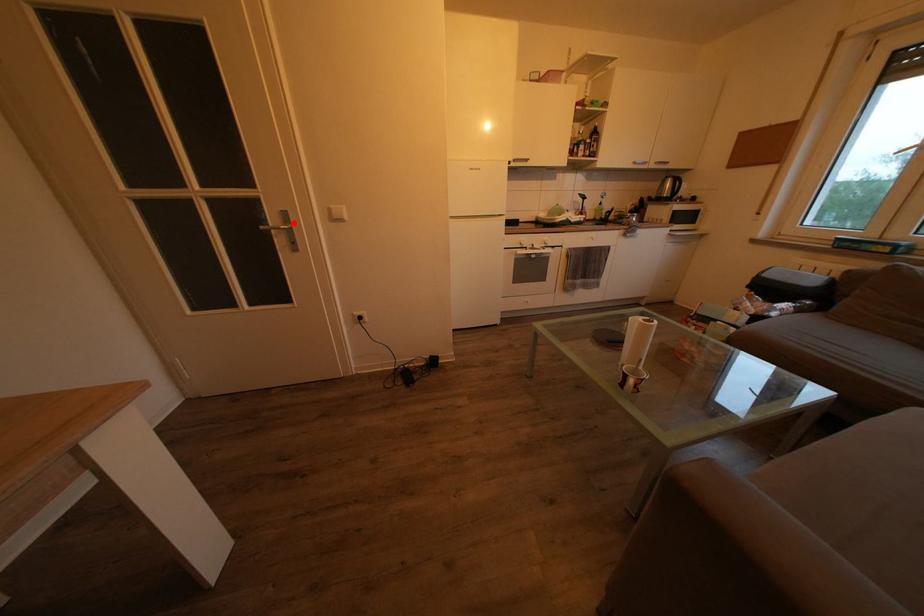
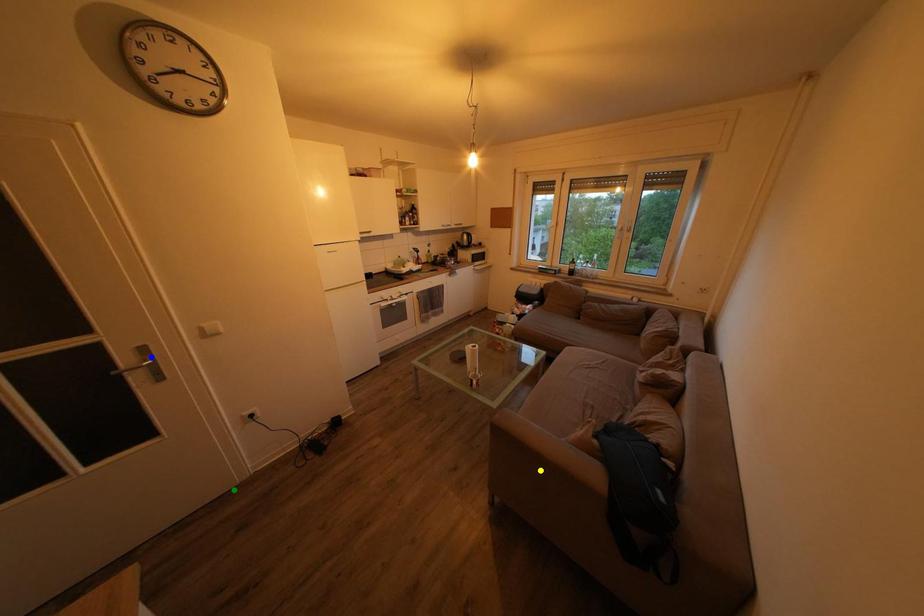
Question: I am providing you with two images of the same scene from different viewpoints. A red point is marked on the first image. You are given multiple points on the second image. Which mark in image 2 goes with the point in image 1?

Choices:
 (A) yellow point
 (B) green point
 (C) blue point

Answer: (C)